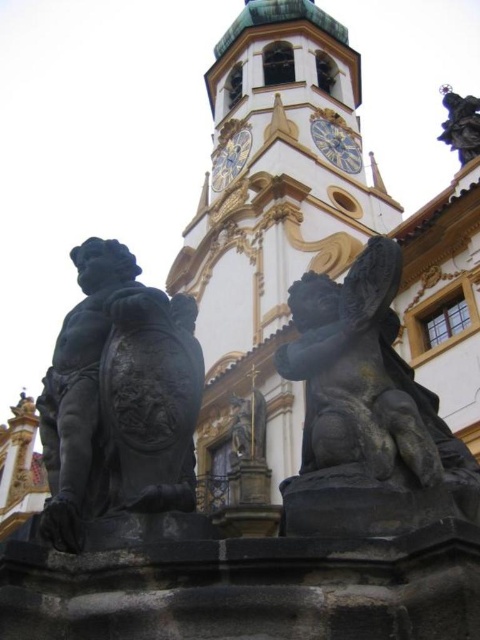
Question: Does black stone cherub at upper right have a smaller size compared to gold metallic clock at upper center?

Choices:
 (A) no
 (B) yes

Answer: (B)

Question: Does gold-plated stone clock tower at center appear on the right side of goldmetallicclock at upper center?

Choices:
 (A) no
 (B) yes

Answer: (B)

Question: Estimate the real-world distances between objects in this image. Which object is closer to the black polished statue at left?

Choices:
 (A) gold-plated stone clock tower at center
 (B) black stone cherub at upper right

Answer: (B)

Question: Can you confirm if black polished statue at left is positioned to the right of goldmetallicclock at upper center?

Choices:
 (A) yes
 (B) no

Answer: (B)

Question: Which point is farther to the camera?

Choices:
 (A) (112, 280)
 (B) (299, 212)

Answer: (B)

Question: Which point is closer to the camera?

Choices:
 (A) (437, 138)
 (B) (321, 150)
 (C) (277, 273)

Answer: (A)